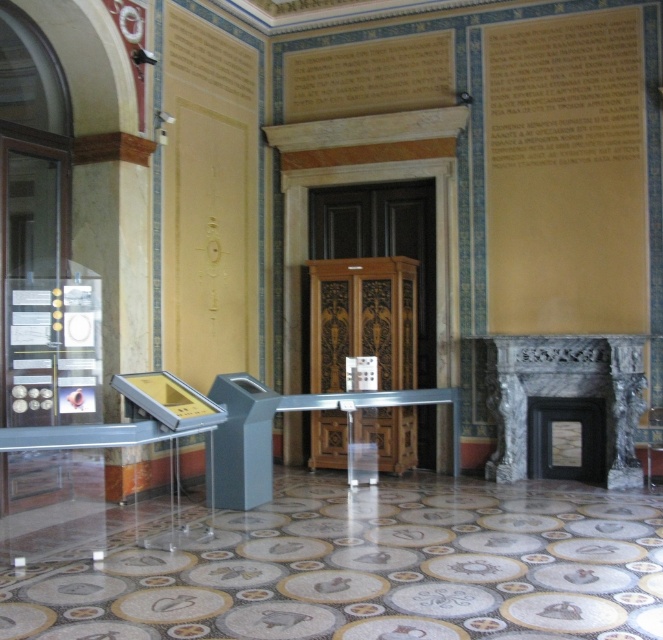
You are standing in the museum and want to locate the wooden carved elevator at center. According to the coordinates provided, where exactly is it positioned?

The wooden carved elevator at center is located at point coordinates 0.500 in the x axis and 0.548 in the y axis.

You are a visitor standing in the museum and want to take a photo of the wooden carved elevator at center and the marble fireplace at right. Since you want both objects in the same frame, which one should you position closer to the camera?

You should position the marble fireplace at right closer to the camera because the wooden carved elevator at center is located above it, so moving closer to the fireplace will keep both in the frame.

You are a visitor in this museum and want to take a photo of both the wooden carved elevator at center and the marble fireplace at right. Which object should you stand closer to in order to fit both into your camera frame?

Since the wooden carved elevator at center is smaller than the marble fireplace at right, you should stand closer to the wooden carved elevator at center to ensure both objects are visible in the camera frame.